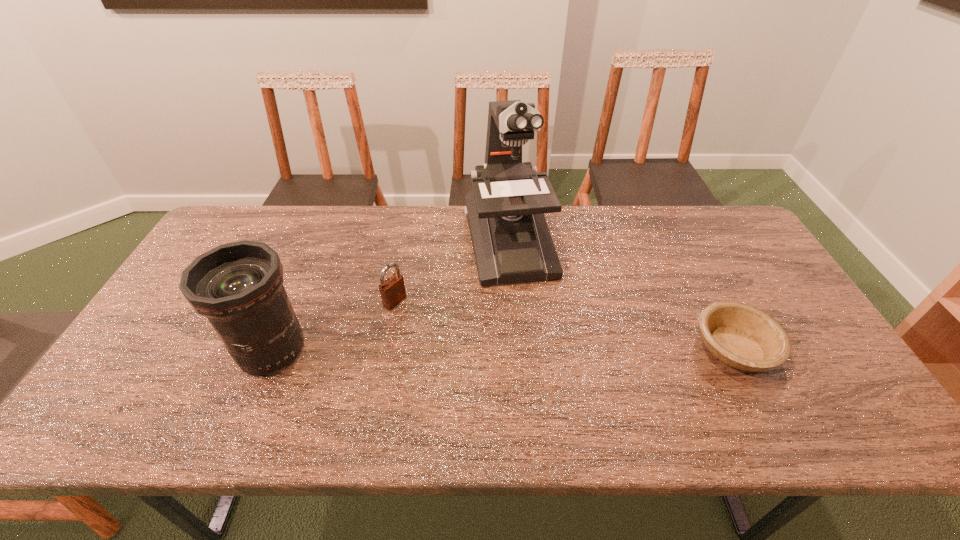
Identify the location of vacant space that is in between the second object from left to right and the telephoto lens. This screenshot has height=540, width=960. (333, 325).

Find the location of a particular element. object that is the third nearest to the leftmost object is located at coordinates (741, 336).

Find the location of a particular element. The width and height of the screenshot is (960, 540). object that stands as the closest to the third tallest object is located at coordinates (511, 240).

Where is `free space in the image that satisfies the following two spatial constraints: 1. on the front side of the rightmost object; 2. on the left side of the farthest object`? This screenshot has height=540, width=960. free space in the image that satisfies the following two spatial constraints: 1. on the front side of the rightmost object; 2. on the left side of the farthest object is located at coordinates (517, 349).

Where is `vacant area in the image that satisfies the following two spatial constraints: 1. on the back side of the microscope; 2. on the right side of the padlock`? vacant area in the image that satisfies the following two spatial constraints: 1. on the back side of the microscope; 2. on the right side of the padlock is located at coordinates 406,242.